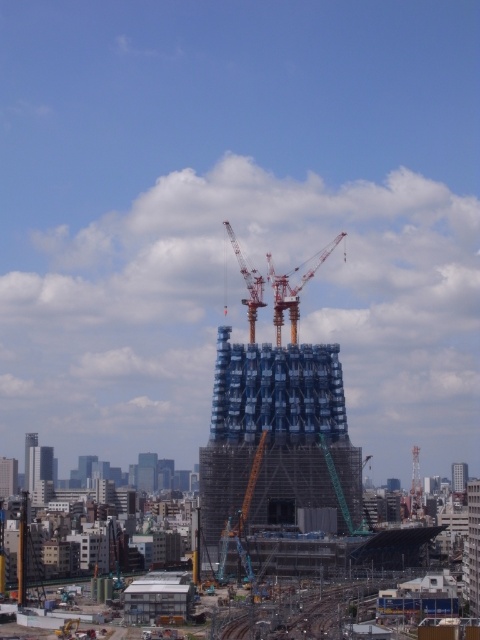
You are a construction worker standing on the ground floor of the blue glass skyscraper at center. You need to transport materials to the metal train track at lower center. Which direction should you move to reach the track?

The metal train track at lower center is above the blue glass skyscraper at center, so you should move upward to reach the track.